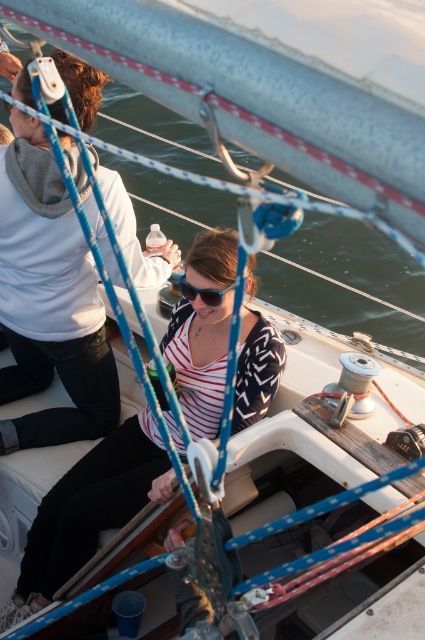
You are a photographer on the boat and want to capture a photo that includes both the white hoodie at upper left and the sunglasses at center. Which object should you ensure is placed higher in the frame to maintain their natural positions?

The white hoodie at upper left should be placed higher in the frame since it has a greater height compared to the sunglasses at center, maintaining their natural positions.

You are a photographer trying to capture a candid shot of the woman on the boat. You notice the white hoodie at upper left and the sunglasses at center. Which object is positioned higher in the frame?

The white hoodie at upper left is located above the sunglasses at center in the frame.

You are a photographer on the boat and want to capture a closeup of the striped fabric shirt at center and sunglasses at center. The camera you have can only focus on objects within a 20 inch range. Can you take a photo of both objects without moving the camera?

The striped fabric shirt at center is 24.31 inches away from sunglasses at center. Since the camera can only focus within a 20 inch range, the distance between them exceeds the camera focus range. Therefore, you cannot take a photo of both objects without moving the camera.